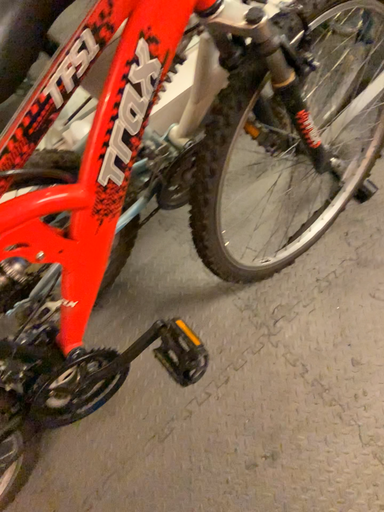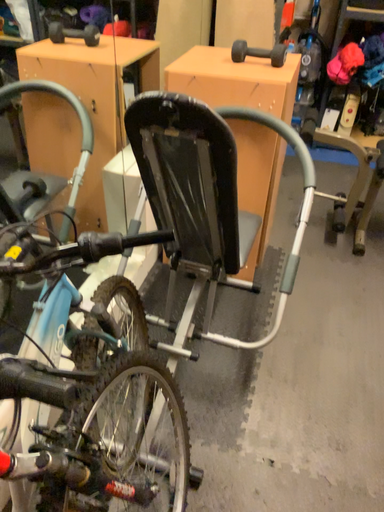
Question: How did the camera likely rotate when shooting the video?

Choices:
 (A) rotated left
 (B) rotated right

Answer: (B)